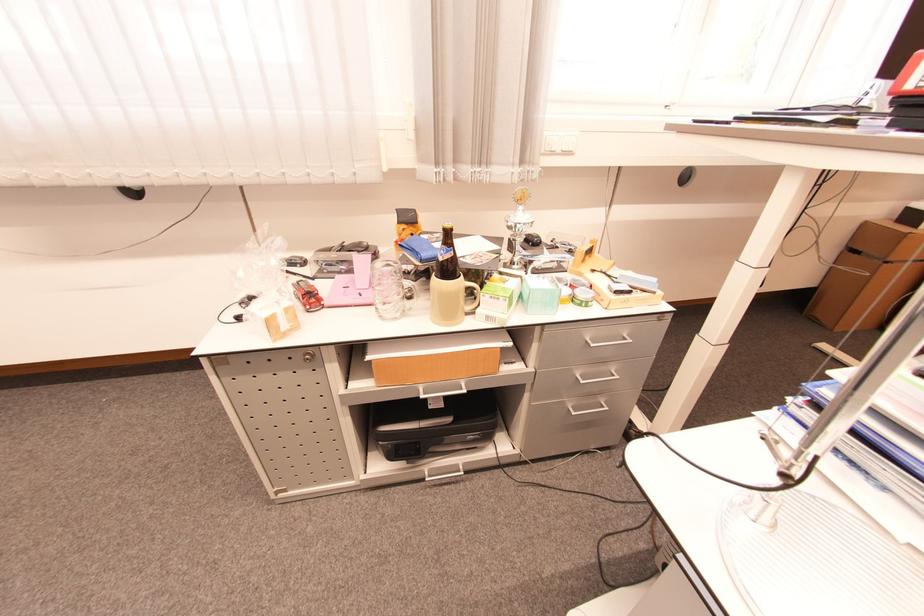
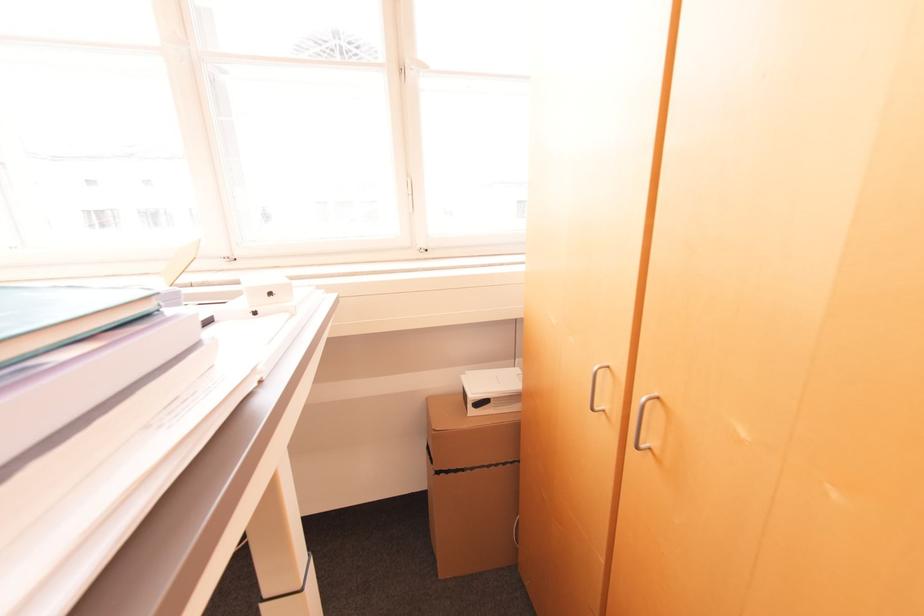
Question: What movement of the cameraman would produce the second image?

Choices:
 (A) Left
 (B) Right
 (C) Forward
 (D) Backward

Answer: (B)